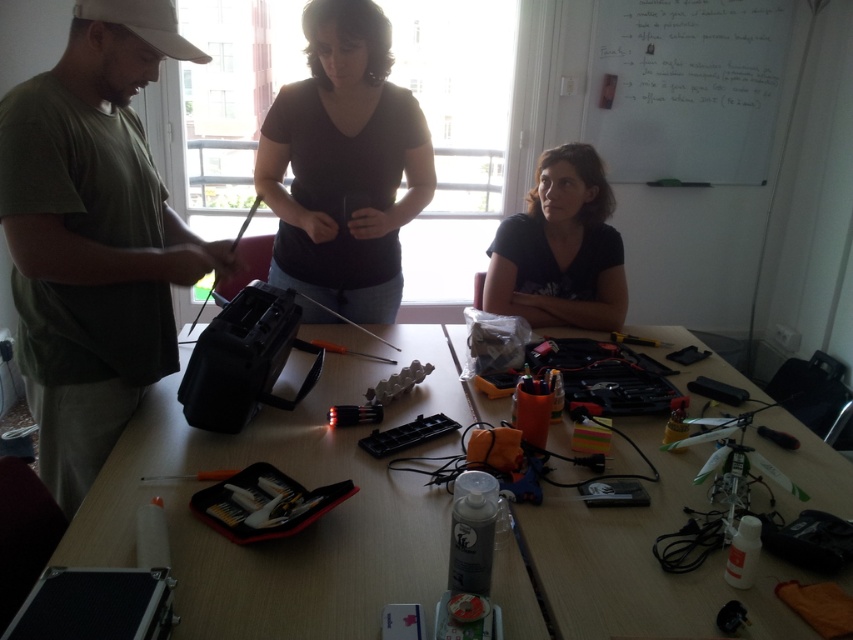
Can you confirm if green matte shirt at left is shorter than black plastic toolbox at center?

In fact, green matte shirt at left may be taller than black plastic toolbox at center.

Is point (149, 221) closer to viewer compared to point (322, 353)?

Yes.

I want to click on green matte shirt at left, so click(93, 236).

Does point (660, 486) come farther from viewer compared to point (575, 317)?

No, (660, 486) is closer to viewer.

Does wooden table at center have a larger size compared to dark blue t-shirt at center?

Correct, wooden table at center is larger in size than dark blue t-shirt at center.

Locate an element on the screen. The height and width of the screenshot is (640, 853). wooden table at center is located at coordinates (276, 540).

Can you confirm if green matte shirt at left is shorter than dark blue t-shirt at center?

No.

Who is shorter, green matte shirt at left or dark blue t-shirt at center?

dark blue t-shirt at center is shorter.

Which is in front, point (155, 301) or point (531, 241)?

Positioned in front is point (155, 301).

You are a GUI agent. You are given a task and a screenshot of the screen. Output one action in this format:
    pyautogui.click(x=<x>, y=<y>)
    Task: Click on the green matte shirt at left
    Image resolution: width=853 pixels, height=640 pixels.
    Given the screenshot: What is the action you would take?
    pyautogui.click(x=93, y=236)